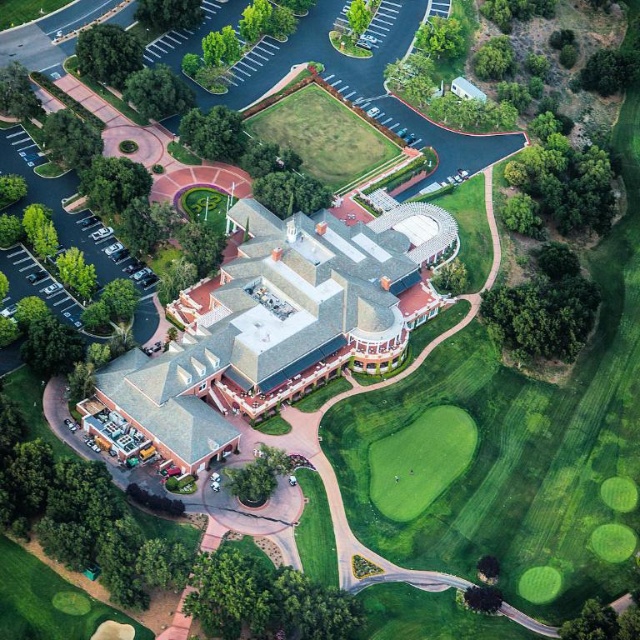
Can you confirm if light brown stone mansion at center is positioned above green smooth turf at center?

Yes, light brown stone mansion at center is above green smooth turf at center.

From the picture: Which is above, light brown stone mansion at center or green smooth turf at center?

Positioned higher is light brown stone mansion at center.

Locate an element on the screen. light brown stone mansion at center is located at coordinates (280, 323).

Looking at this image, which is more to the right, light brown stone mansion at center or white plastic antenna at center?

Positioned to the right is light brown stone mansion at center.

Which is below, light brown stone mansion at center or white plastic antenna at center?

Positioned lower is light brown stone mansion at center.

Looking at this image, who is more forward, (177,448) or (227,205)?

Point (177,448) is more forward.

Where is `light brown stone mansion at center`? The height and width of the screenshot is (640, 640). light brown stone mansion at center is located at coordinates (280, 323).

Does green smooth turf at center have a greater height compared to white plastic antenna at center?

Correct, green smooth turf at center is much taller as white plastic antenna at center.

Can you confirm if green smooth turf at center is positioned to the left of white plastic antenna at center?

No, green smooth turf at center is not to the left of white plastic antenna at center.

Is point (458, 454) less distant than point (228, 202)?

Yes, point (458, 454) is in front of point (228, 202).

Find the location of a particular element. This screenshot has width=640, height=640. green smooth turf at center is located at coordinates (419, 460).